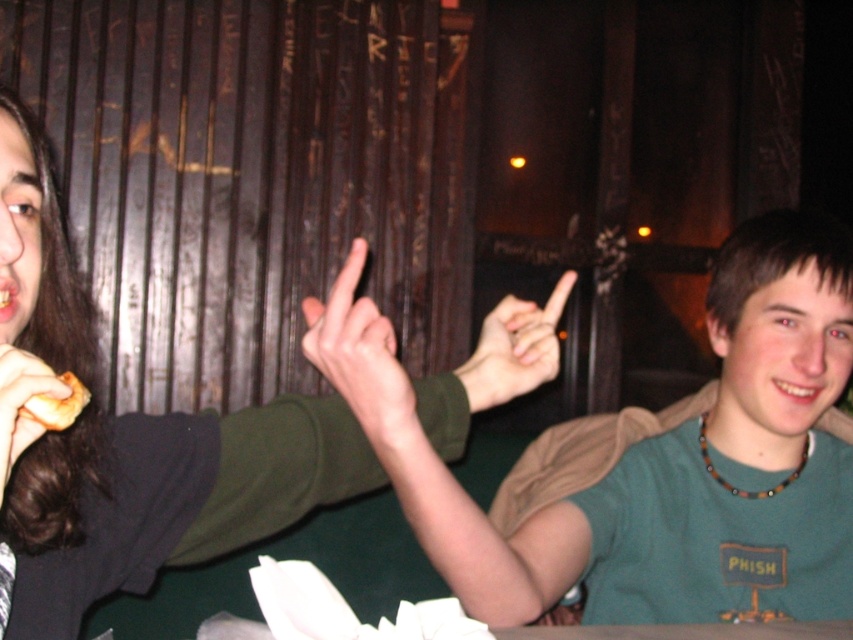
Question: Which point is farther to the camera?

Choices:
 (A) (502, 332)
 (B) (54, 394)
 (C) (334, 321)
 (D) (51, 424)

Answer: (A)

Question: Where is matte green sweater at upper left located in relation to matte green hand at center in the image?

Choices:
 (A) above
 (B) below

Answer: (A)

Question: Estimate the real-world distances between objects in this image. Which object is farther from the green matte shirt at upper right?

Choices:
 (A) matte green hand at upper center
 (B) matte green sweater at upper left
 (C) golden fried chicken at lower left

Answer: (C)

Question: Does matte green hand at center have a lesser width compared to matte brown hair at left?

Choices:
 (A) yes
 (B) no

Answer: (B)

Question: Can you confirm if matte green hand at upper center is smaller than matte brown hair at left?

Choices:
 (A) yes
 (B) no

Answer: (B)

Question: Which object is closer to the camera taking this photo?

Choices:
 (A) green matte shirt at upper right
 (B) matte green hand at center
 (C) matte green hand at upper center
 (D) matte brown hair at left

Answer: (D)